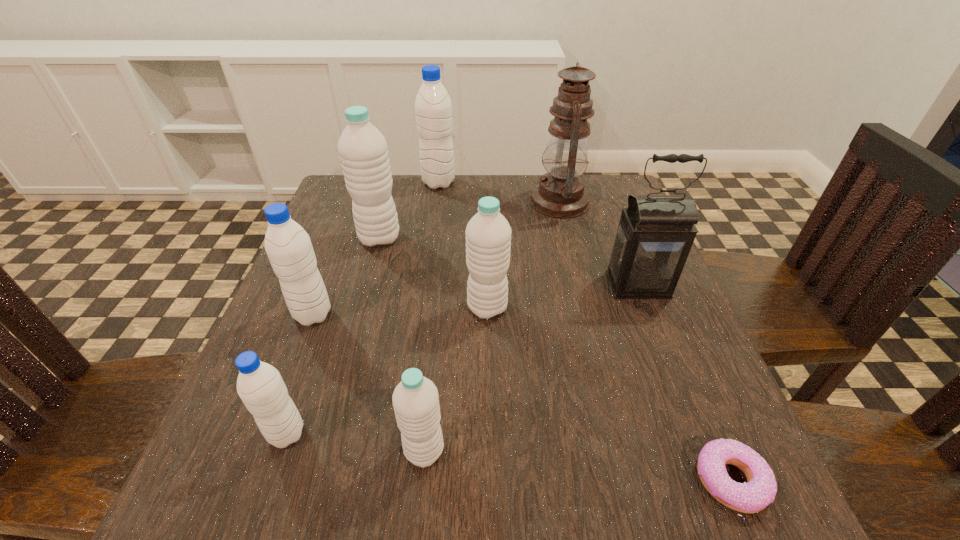
Locate an element on the screen. The height and width of the screenshot is (540, 960). vacant space located on the back of the nearest gray water bottle is located at coordinates (342, 275).

Image resolution: width=960 pixels, height=540 pixels. I want to click on vacant region located on the right of the nearest white water bottle, so click(x=720, y=450).

Find the location of a particular element. Image resolution: width=960 pixels, height=540 pixels. vacant space located on the back of the shortest object is located at coordinates (704, 416).

Where is `oil lamp situated at the far edge`? The image size is (960, 540). oil lamp situated at the far edge is located at coordinates (560, 193).

The image size is (960, 540). What are the coordinates of `water bottle that is at the far edge` in the screenshot? It's located at (433, 107).

At what (x,y) coordinates should I click in order to perform the action: click on water bottle present at the near edge. Please return your answer as a coordinate pair (x, y). Image resolution: width=960 pixels, height=540 pixels. Looking at the image, I should click on (415, 399).

The image size is (960, 540). Find the location of `doughnut that is at the near edge`. doughnut that is at the near edge is located at coordinates (760, 490).

You are a GUI agent. You are given a task and a screenshot of the screen. Output one action in this format:
    pyautogui.click(x=<x>, y=<y>)
    Task: Click on the oil lamp that is at the right edge
    This screenshot has width=960, height=540.
    Given the screenshot: What is the action you would take?
    pyautogui.click(x=560, y=193)

Locate an element on the screen. The height and width of the screenshot is (540, 960). lantern at the right edge is located at coordinates (655, 234).

The width and height of the screenshot is (960, 540). Identify the location of doughnut located at the right edge. (760, 490).